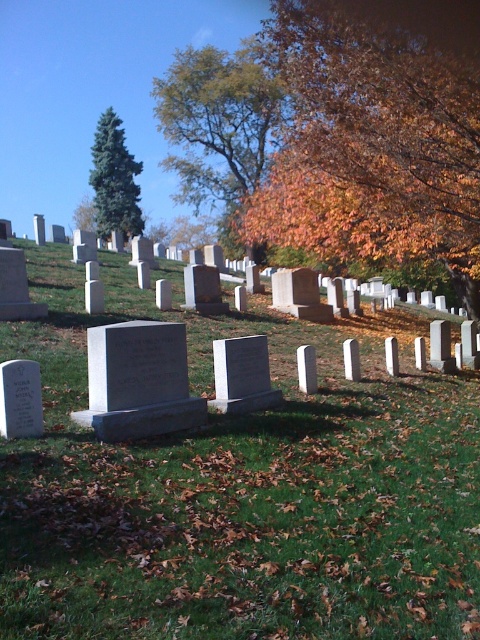
Question: Which object is closer to the camera taking this photo?

Choices:
 (A) green matte evergreen tree at upper left
 (B) orange leafy tree at upper center

Answer: (B)

Question: Which object is the farthest from the orange leafy tree at upper center?

Choices:
 (A) green matte evergreen tree at upper left
 (B) green leafy tree at upper center
 (C) green grassy at center

Answer: (A)

Question: Which point is farther to the camera?

Choices:
 (A) (279, 163)
 (B) (158, 525)
 (C) (101, 150)

Answer: (C)

Question: Considering the relative positions of green grassy at center and orange leafy tree at upper center in the image provided, where is green grassy at center located with respect to orange leafy tree at upper center?

Choices:
 (A) above
 (B) below

Answer: (B)

Question: Can you confirm if green grassy at center is bigger than green leafy tree at upper center?

Choices:
 (A) no
 (B) yes

Answer: (A)

Question: Is orange leafy tree at upper center in front of green leafy tree at upper center?

Choices:
 (A) no
 (B) yes

Answer: (B)